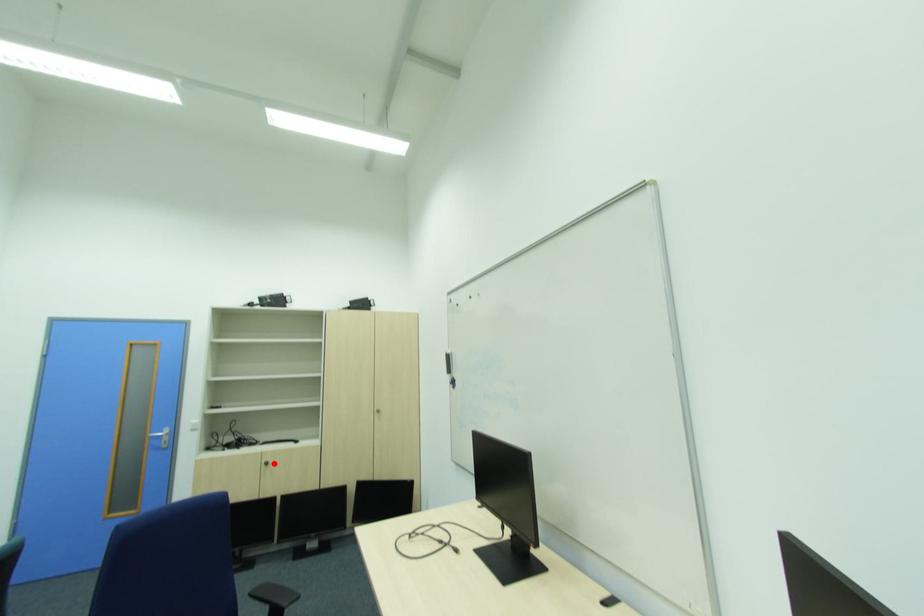
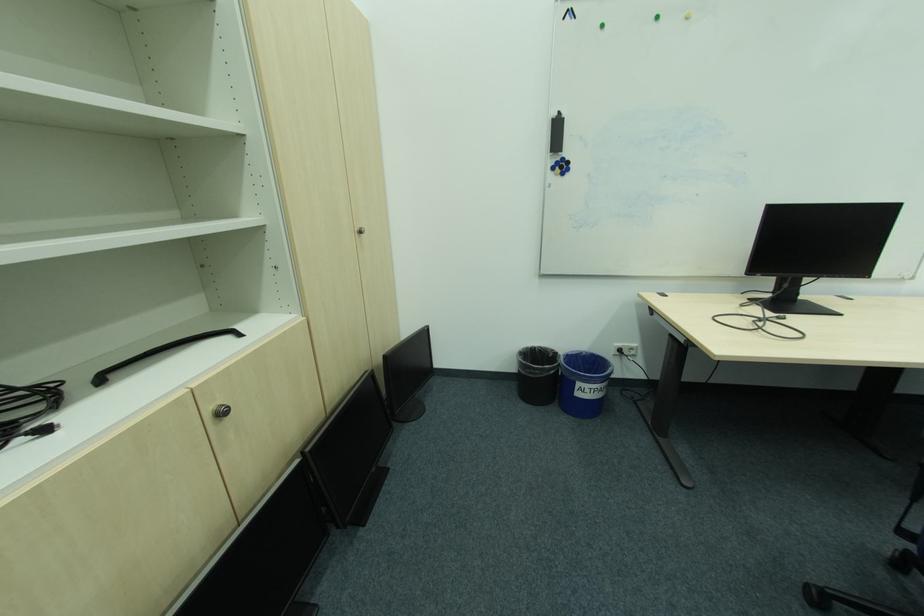
Question: I am providing you with two images of the same scene from different viewpoints. Image1 has a red point marked. In image2, the corresponding 3D location appears at what relative position? Reply with the corresponding letter.

Choices:
 (A) Closer
 (B) Farther

Answer: (A)